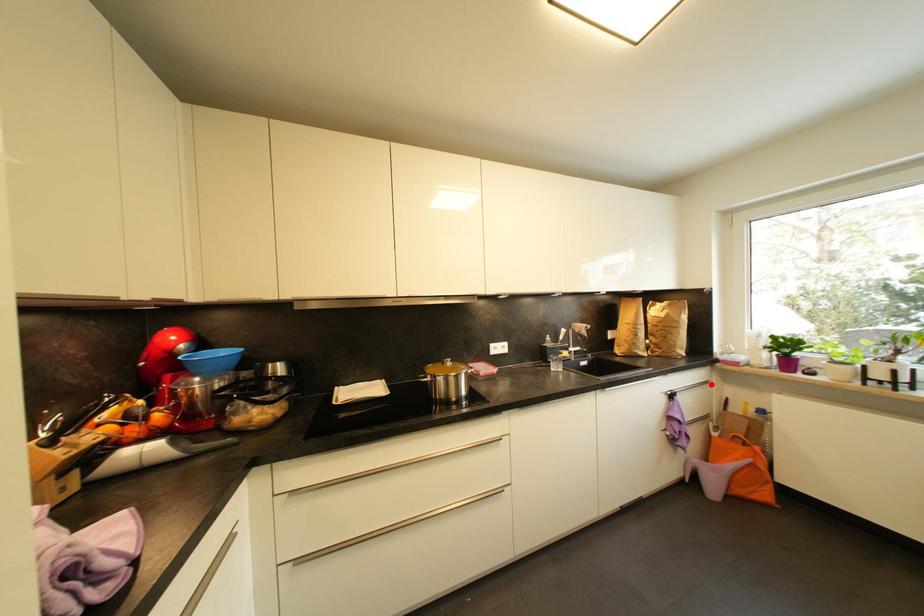
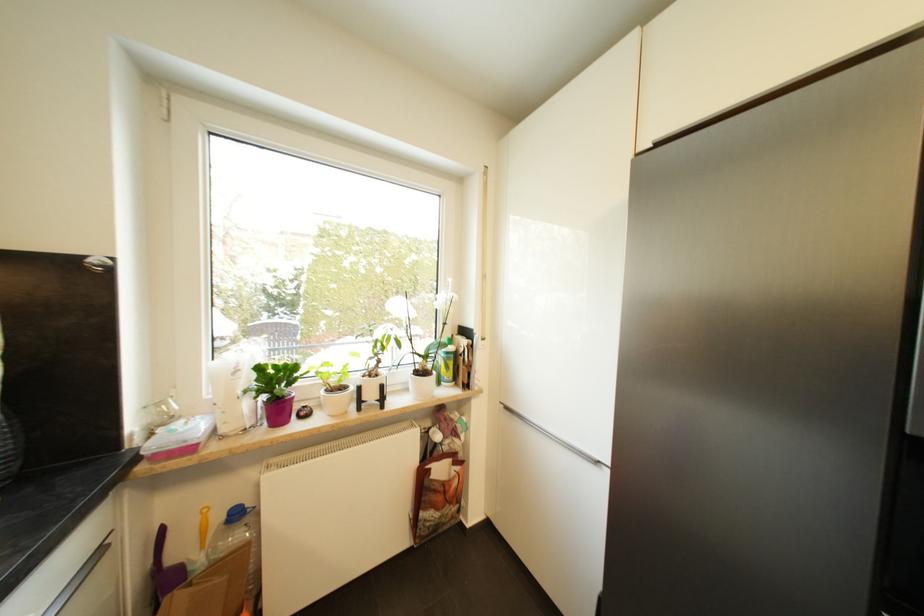
The point at the highlighted location is marked in the first image. Where is the corresponding point in the second image?

(105, 553)